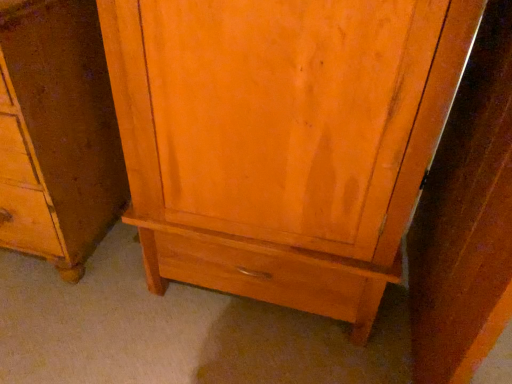
Question: Is matte wood cupboard at center facing away from matte wood cabinet at center?

Choices:
 (A) yes
 (B) no

Answer: (B)

Question: Is matte wood cupboard at center taller than matte wood cabinet at center?

Choices:
 (A) no
 (B) yes

Answer: (B)

Question: From a real-world perspective, is matte wood cupboard at center over matte wood cabinet at center?

Choices:
 (A) no
 (B) yes

Answer: (B)

Question: Considering the relative positions of matte wood cupboard at center and matte wood cabinet at center in the image provided, is matte wood cupboard at center in front of matte wood cabinet at center?

Choices:
 (A) yes
 (B) no

Answer: (A)

Question: Does matte wood cupboard at center have a lesser height compared to matte wood cabinet at center?

Choices:
 (A) no
 (B) yes

Answer: (A)

Question: From the image's perspective, is matte wood cupboard at center under matte wood cabinet at center?

Choices:
 (A) no
 (B) yes

Answer: (B)

Question: Is matte wood cabinet at center to the left of matte wood cupboard at center from the viewer's perspective?

Choices:
 (A) no
 (B) yes

Answer: (B)

Question: Is matte wood cabinet at center positioned far away from matte wood cupboard at center?

Choices:
 (A) no
 (B) yes

Answer: (A)

Question: Can you confirm if matte wood cabinet at center is smaller than matte wood cupboard at center?

Choices:
 (A) yes
 (B) no

Answer: (A)

Question: Is matte wood cabinet at center taller than matte wood cupboard at center?

Choices:
 (A) no
 (B) yes

Answer: (A)

Question: Considering the relative positions of matte wood cabinet at center and matte wood cupboard at center in the image provided, is matte wood cabinet at center to the right of matte wood cupboard at center from the viewer's perspective?

Choices:
 (A) yes
 (B) no

Answer: (B)

Question: Is matte wood cupboard at center at the back of matte wood cabinet at center?

Choices:
 (A) yes
 (B) no

Answer: (B)

Question: Is point (90, 72) closer or farther from the camera than point (324, 3)?

Choices:
 (A) farther
 (B) closer

Answer: (A)